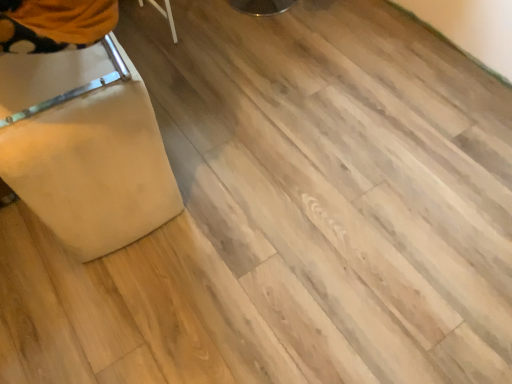
Find the location of a particular element. free spot to the right of beige fabric ottoman at lower left is located at coordinates (217, 154).